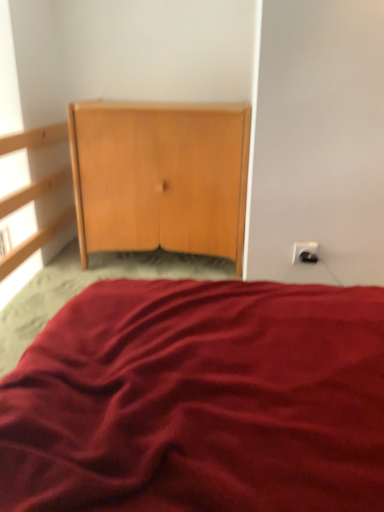
Question: Does white plastic electric outlet at right have a lesser height compared to light wood/texture cupboard at center?

Choices:
 (A) yes
 (B) no

Answer: (A)

Question: Is white plastic electric outlet at right smaller than light wood/texture cupboard at center?

Choices:
 (A) yes
 (B) no

Answer: (A)

Question: Is white plastic electric outlet at right further to camera compared to light wood/texture cupboard at center?

Choices:
 (A) no
 (B) yes

Answer: (A)

Question: Is white plastic electric outlet at right not near light wood/texture cupboard at center?

Choices:
 (A) yes
 (B) no

Answer: (B)

Question: Considering the relative sizes of white plastic electric outlet at right and light wood/texture cupboard at center in the image provided, is white plastic electric outlet at right thinner than light wood/texture cupboard at center?

Choices:
 (A) no
 (B) yes

Answer: (B)

Question: Is white plastic electric outlet at right closer to the viewer compared to light wood/texture cupboard at center?

Choices:
 (A) no
 (B) yes

Answer: (B)

Question: Is light wood/texture cupboard at center not inside white plastic electric outlet at right?

Choices:
 (A) yes
 (B) no

Answer: (A)

Question: From the image's perspective, is light wood/texture cupboard at center beneath white plastic electric outlet at right?

Choices:
 (A) yes
 (B) no

Answer: (B)

Question: Is light wood/texture cupboard at center to the right of white plastic electric outlet at right from the viewer's perspective?

Choices:
 (A) no
 (B) yes

Answer: (A)

Question: Could you tell me if light wood/texture cupboard at center is turned towards white plastic electric outlet at right?

Choices:
 (A) no
 (B) yes

Answer: (A)

Question: Is light wood/texture cupboard at center smaller than white plastic electric outlet at right?

Choices:
 (A) yes
 (B) no

Answer: (B)

Question: From a real-world perspective, is light wood/texture cupboard at center located beneath white plastic electric outlet at right?

Choices:
 (A) no
 (B) yes

Answer: (A)

Question: In terms of height, does light wood/texture cupboard at center look taller or shorter compared to white plastic electric outlet at right?

Choices:
 (A) short
 (B) tall

Answer: (B)